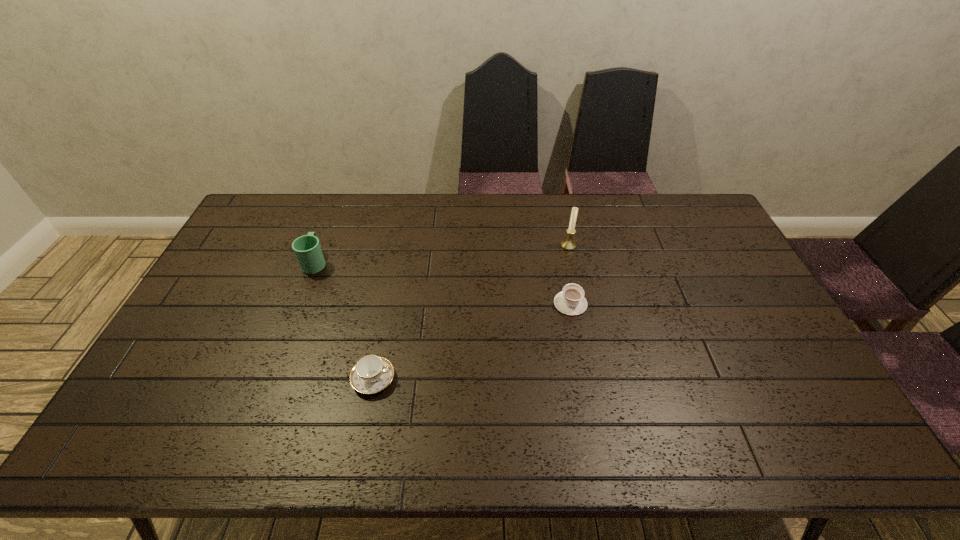
The image size is (960, 540). In the image, there is a desktop. Identify the location of vacant area at the far right corner. (677, 230).

The image size is (960, 540). Find the location of `vacant space in between the nearest object and the mug`. vacant space in between the nearest object and the mug is located at coordinates (345, 321).

Find the location of a particular element. The image size is (960, 540). vacant space that's between the candle holder and the third object from right to left is located at coordinates (471, 312).

At what (x,y) coordinates should I click in order to perform the action: click on free space that is in between the candle holder and the right teacup. Please return your answer as a coordinate pair (x, y). Looking at the image, I should click on (569, 274).

Locate an element on the screen. Image resolution: width=960 pixels, height=540 pixels. vacant region between the third object from right to left and the farther teacup is located at coordinates (472, 341).

Where is `free space between the right teacup and the left teacup`? The image size is (960, 540). free space between the right teacup and the left teacup is located at coordinates (472, 341).

Image resolution: width=960 pixels, height=540 pixels. Find the location of `unoccupied position between the third farthest object and the second object from left to right`. unoccupied position between the third farthest object and the second object from left to right is located at coordinates (472, 341).

What are the coordinates of `vacant area that lies between the second tallest object and the nearer teacup` in the screenshot? It's located at (345, 321).

The image size is (960, 540). Find the location of `free spot between the tallest object and the mug`. free spot between the tallest object and the mug is located at coordinates (442, 254).

The width and height of the screenshot is (960, 540). Find the location of `free space between the nearest object and the leftmost object`. free space between the nearest object and the leftmost object is located at coordinates (345, 321).